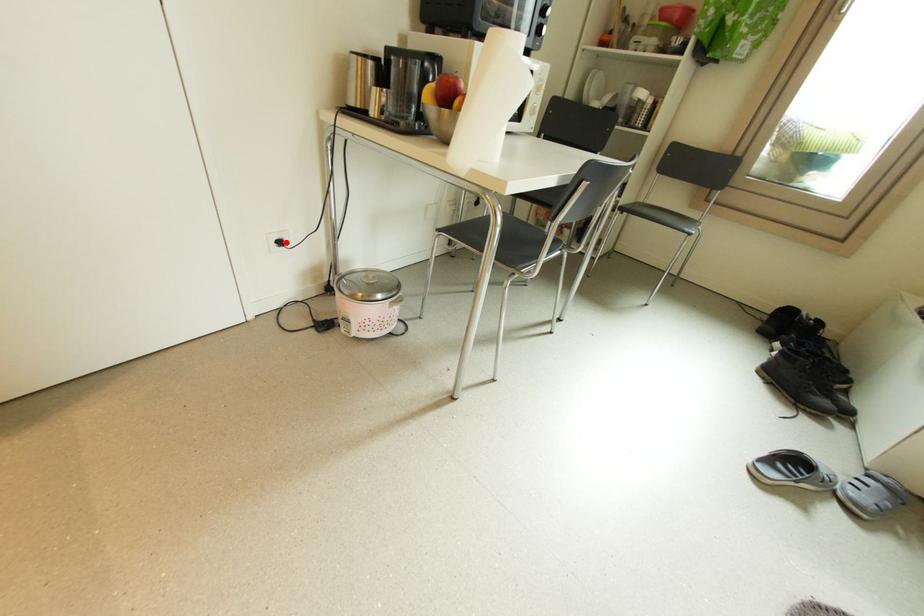
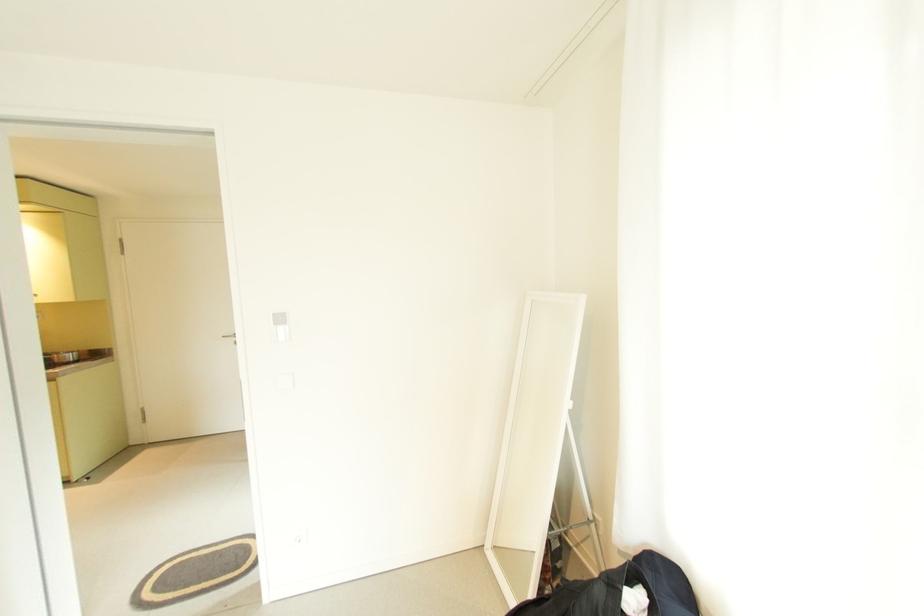
Question: I am providing you with two images of the same scene from different viewpoints. A red point is marked on the first image. Can you still see the location of the red point in image 2?

Choices:
 (A) Yes
 (B) No

Answer: (B)